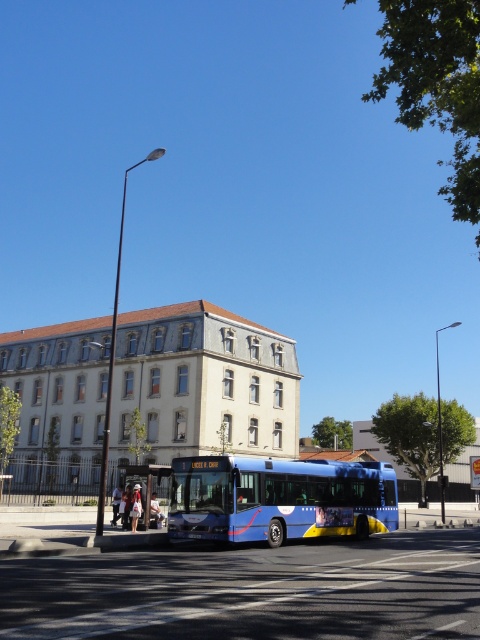
Question: Is blue metallic bus at center above metallic bus stop at lower left?

Choices:
 (A) no
 (B) yes

Answer: (B)

Question: Can you confirm if blue metallic bus at center is wider than metallic bus stop at lower left?

Choices:
 (A) yes
 (B) no

Answer: (B)

Question: Which point is closer to the camera?

Choices:
 (A) (212, 500)
 (B) (168, 476)

Answer: (A)

Question: Can you confirm if blue metallic bus at center is thinner than metallic bus stop at lower left?

Choices:
 (A) yes
 (B) no

Answer: (A)

Question: Which of the following is the farthest from the observer?

Choices:
 (A) click(143, 502)
 (B) click(172, 531)

Answer: (A)